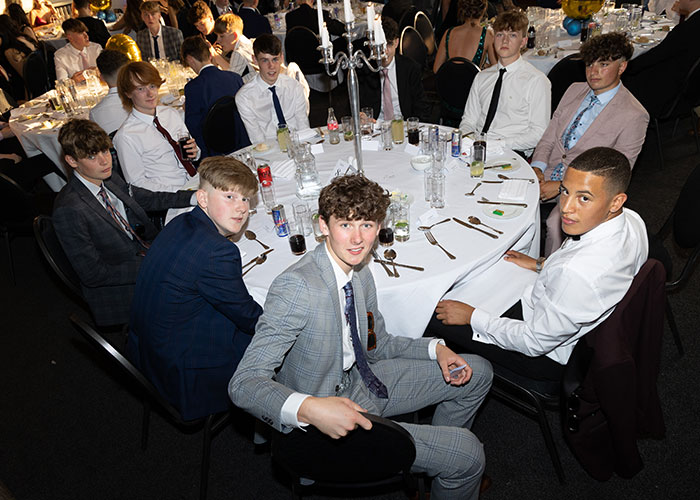
This screenshot has height=500, width=700. Identify the location of spoon. (250, 236), (260, 259), (391, 256), (475, 217), (500, 176).